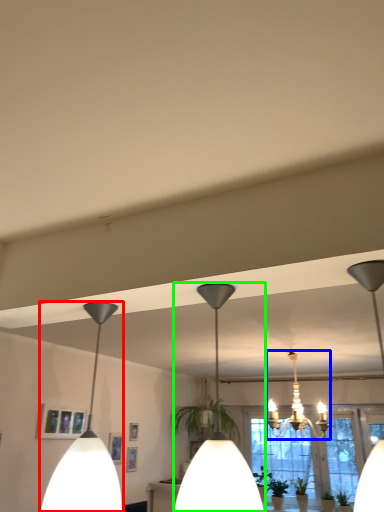
Question: Estimate the real-world distances between objects in this image. Which object is closer to lamp (highlighted by a red box), lamp (highlighted by a blue box) or lamp (highlighted by a green box)?

Choices:
 (A) lamp
 (B) lamp

Answer: (B)